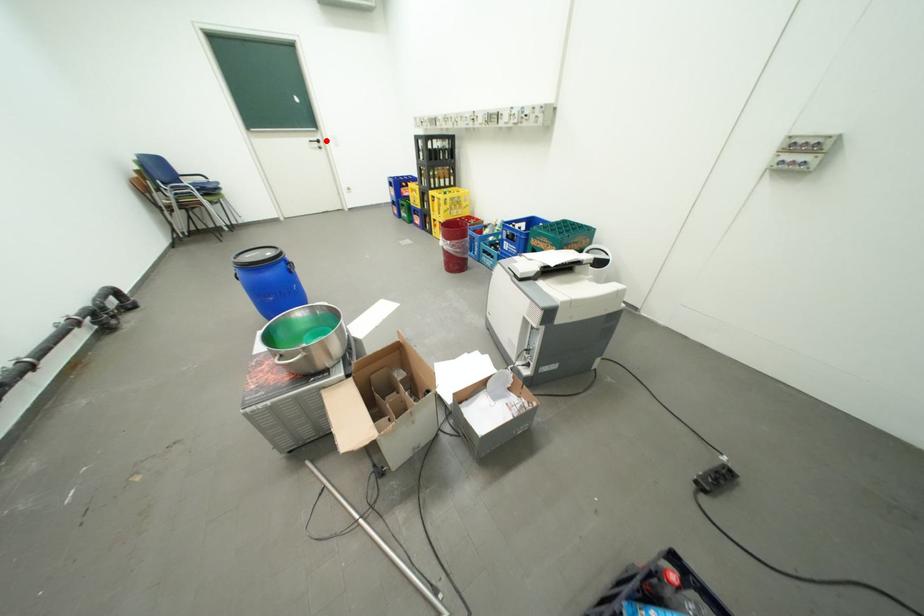
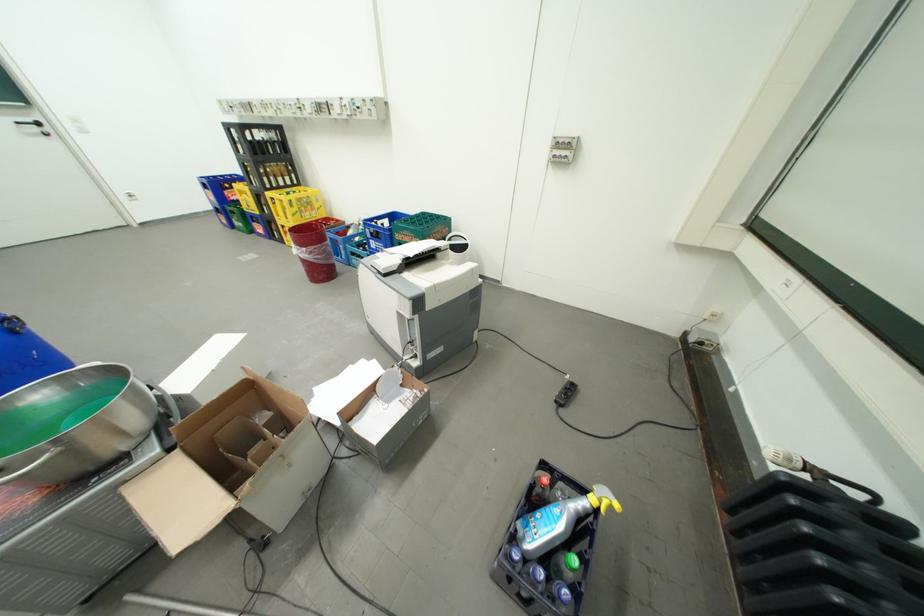
In the second image, find the point that corresponds to the highlighted location in the first image.

(41, 122)